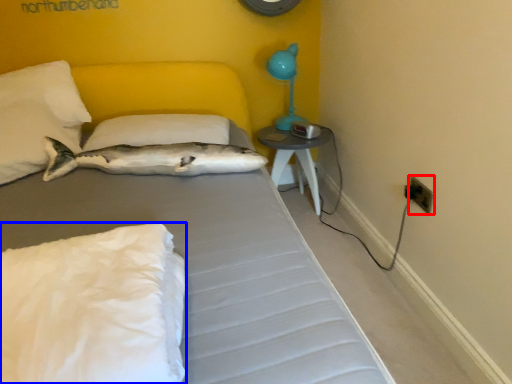
Question: Which object appears closest to the camera in this image, electric outlet (highlighted by a red box) or pillow (highlighted by a blue box)?

Choices:
 (A) electric outlet
 (B) pillow

Answer: (B)